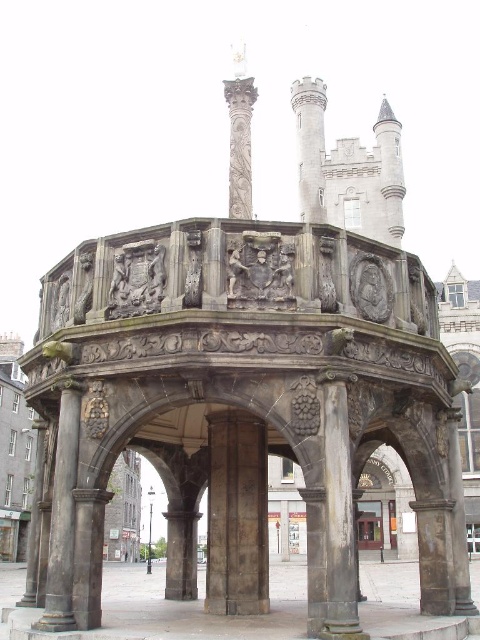
You are a visitor standing in the town square facing the historic stone structure. You notice the dark gray stone column at center and the glass door at center. Which object is taller?

The glass door at center is taller than the dark gray stone column at center according to the description.